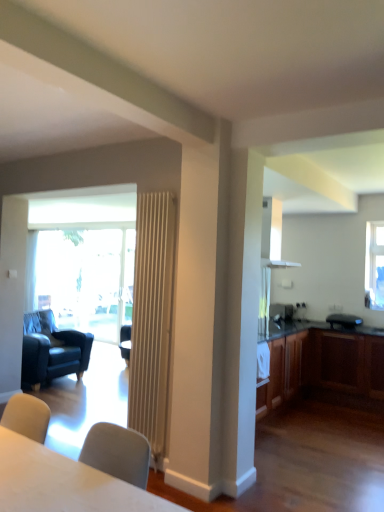
Question: Is clear glass window at upper right directly adjacent to satin silver microwave at right?

Choices:
 (A) no
 (B) yes

Answer: (A)

Question: Considering the relative sizes of clear glass window at upper right and satin silver microwave at right in the image provided, is clear glass window at upper right thinner than satin silver microwave at right?

Choices:
 (A) no
 (B) yes

Answer: (B)

Question: Is clear glass window at upper right bigger than satin silver microwave at right?

Choices:
 (A) no
 (B) yes

Answer: (A)

Question: Is satin silver microwave at right inside clear glass window at upper right?

Choices:
 (A) no
 (B) yes

Answer: (A)

Question: From the image's perspective, is clear glass window at upper right beneath satin silver microwave at right?

Choices:
 (A) no
 (B) yes

Answer: (A)

Question: Considering the positions of clear glass window at upper right and wooden cabinet at right in the image, is clear glass window at upper right taller or shorter than wooden cabinet at right?

Choices:
 (A) tall
 (B) short

Answer: (A)

Question: From the image's perspective, relative to wooden cabinet at right, is clear glass window at upper right above or below?

Choices:
 (A) below
 (B) above

Answer: (B)

Question: Relative to wooden cabinet at right, is clear glass window at upper right in front or behind?

Choices:
 (A) behind
 (B) front

Answer: (A)

Question: Considering the positions of clear glass window at upper right and wooden cabinet at right in the image, is clear glass window at upper right wider or thinner than wooden cabinet at right?

Choices:
 (A) thin
 (B) wide

Answer: (A)

Question: From the image's perspective, is wooden radiator at center above or below clear glass window at upper right?

Choices:
 (A) above
 (B) below

Answer: (B)

Question: In terms of height, does wooden radiator at center look taller or shorter compared to clear glass window at upper right?

Choices:
 (A) tall
 (B) short

Answer: (A)

Question: Is wooden radiator at center spatially inside clear glass window at upper right, or outside of it?

Choices:
 (A) outside
 (B) inside

Answer: (A)

Question: Is point (160, 305) closer or farther from the camera than point (380, 275)?

Choices:
 (A) farther
 (B) closer

Answer: (B)

Question: Would you say wooden cabinet at right is to the left or to the right of satin silver microwave at right in the picture?

Choices:
 (A) right
 (B) left

Answer: (A)

Question: Does point (377, 335) appear closer or farther from the camera than point (283, 311)?

Choices:
 (A) closer
 (B) farther

Answer: (A)